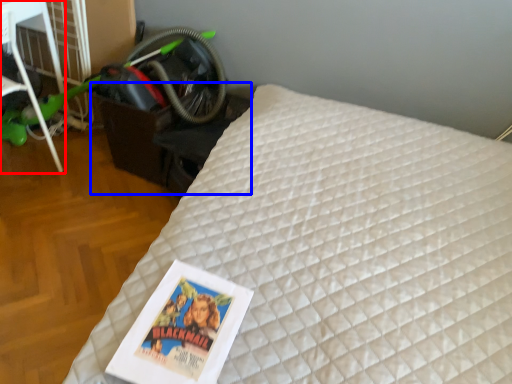
Question: Which object appears farthest to the camera in this image, furniture (highlighted by a red box) or table (highlighted by a blue box)?

Choices:
 (A) furniture
 (B) table

Answer: (B)